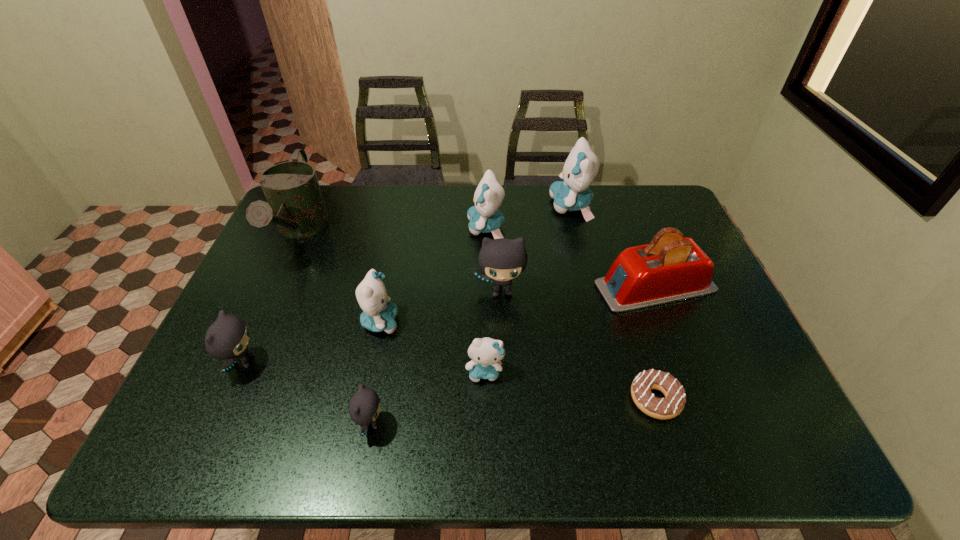
What are the coordinates of `the rightmost blue kitten` in the screenshot? It's located at (581, 167).

Locate an element on the screen. the biggest blue kitten is located at coordinates (581, 167).

Identify the location of watering can. The width and height of the screenshot is (960, 540). (295, 204).

Image resolution: width=960 pixels, height=540 pixels. In order to click on the second biggest blue kitten in this screenshot , I will do `click(484, 217)`.

Where is `red toaster`? red toaster is located at coordinates (671, 268).

At what (x,y) coordinates should I click in order to perform the action: click on the farthest gray kitten. Please return your answer as a coordinate pair (x, y). Looking at the image, I should click on (502, 260).

Locate an element on the screen. Image resolution: width=960 pixels, height=540 pixels. the rightmost gray kitten is located at coordinates (502, 260).

Find the location of a particular element. Image resolution: width=960 pixels, height=540 pixels. the second smallest blue kitten is located at coordinates (378, 315).

You are a GUI agent. You are given a task and a screenshot of the screen. Output one action in this format:
    pyautogui.click(x=<x>, y=<y>)
    Task: Click on the second nearest blue kitten
    
    Given the screenshot: What is the action you would take?
    pyautogui.click(x=378, y=315)

What are the coordinates of `the leftmost gray kitten` in the screenshot? It's located at (227, 338).